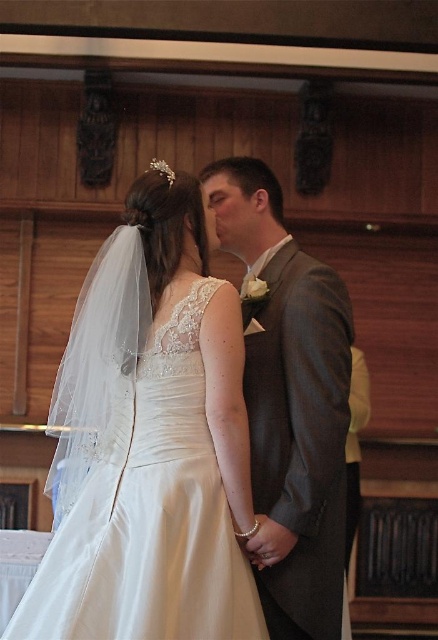
Who is taller, white satin dress at center or gray textured suit at center?

With more height is gray textured suit at center.

Who is positioned more to the right, white satin dress at center or gray textured suit at center?

gray textured suit at center is more to the right.

Is point (95, 604) closer to viewer compared to point (296, 488)?

Yes.

Identify the location of white satin dress at center. The width and height of the screenshot is (438, 640). (149, 442).